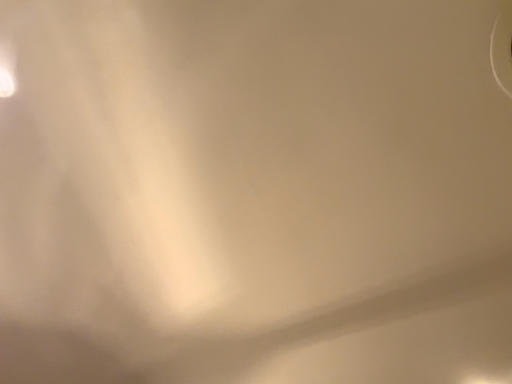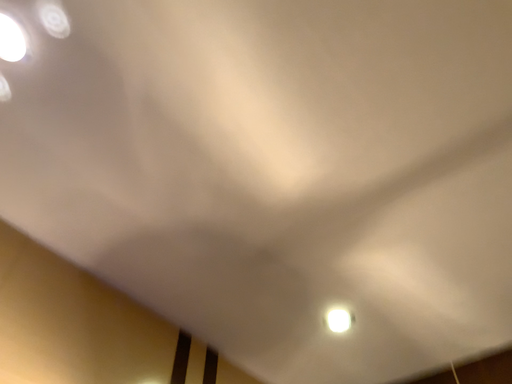
Question: Which way did the camera rotate in the video?

Choices:
 (A) rotated right
 (B) rotated left

Answer: (B)